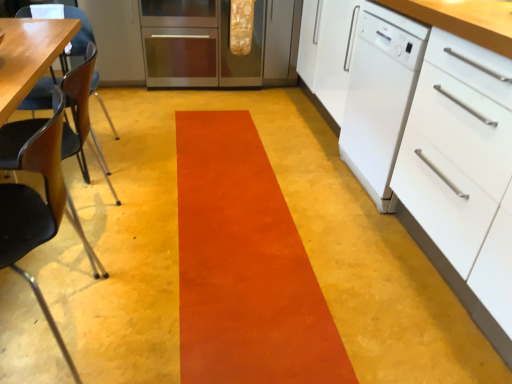
Image resolution: width=512 pixels, height=384 pixels. What are the coordinates of `free spot to the right of wooden chair at left, which is the 1th chair in back-to-front order` in the screenshot? It's located at (151, 161).